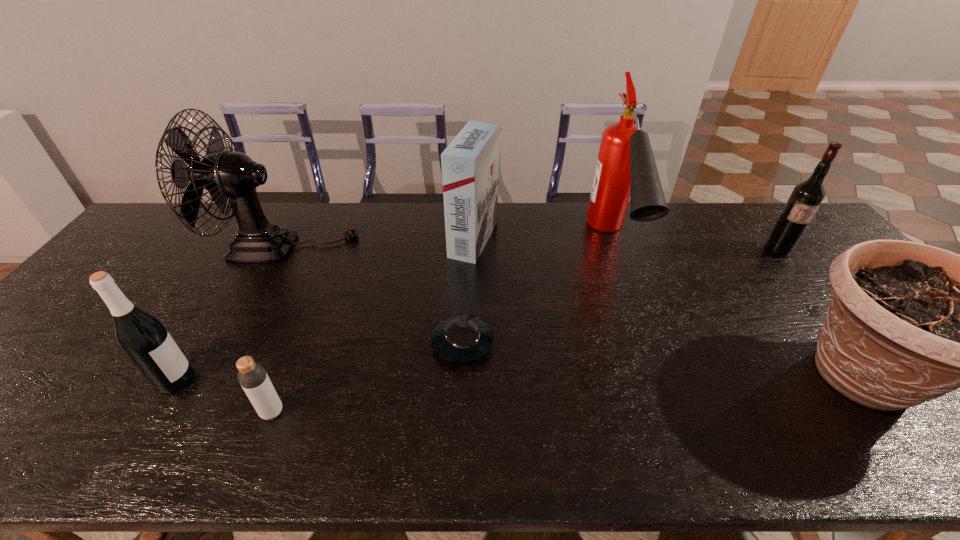
Find the location of a particular element. The image size is (960, 540). vacant space at the far edge is located at coordinates (755, 228).

The width and height of the screenshot is (960, 540). Identify the location of free spot at the near edge of the desktop. (386, 425).

This screenshot has height=540, width=960. In the image, there is a desktop. Find the location of `blank space at the left edge`. blank space at the left edge is located at coordinates (74, 315).

Identify the location of free space between the right wine bottle and the third object from right to left. (695, 247).

I want to click on empty space between the nearer wine bottle and the fan, so click(x=229, y=313).

I want to click on vacant area that lies between the left wine bottle and the cigarette case, so click(x=324, y=309).

You are a GUI agent. You are given a task and a screenshot of the screen. Output one action in this format:
    pyautogui.click(x=<x>, y=<y>)
    Task: Click on the vacant area between the farther wine bottle and the nearer wine bottle
    Image resolution: width=960 pixels, height=540 pixels.
    Given the screenshot: What is the action you would take?
    pyautogui.click(x=476, y=315)

At what (x,y) coordinates should I click in order to perform the action: click on free area in between the cigarette case and the fire extinguisher. Please return your answer as a coordinate pair (x, y). The height and width of the screenshot is (540, 960). Looking at the image, I should click on (542, 241).

The image size is (960, 540). I want to click on unoccupied area between the saucer and the left wine bottle, so click(319, 361).

Find the location of `empty space that is in between the saucer and the bottle`. empty space that is in between the saucer and the bottle is located at coordinates (368, 377).